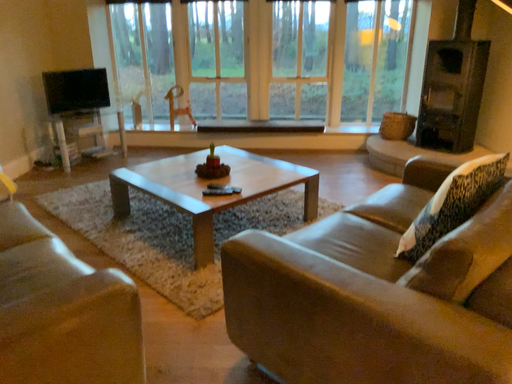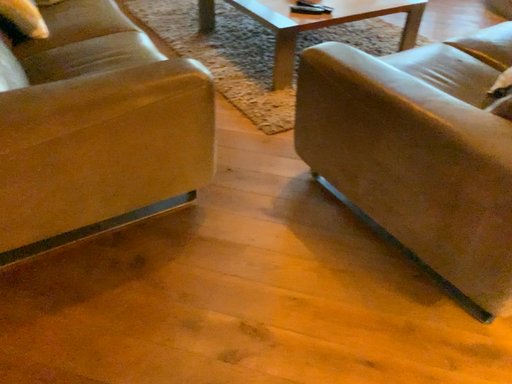
Question: Which way did the camera rotate in the video?

Choices:
 (A) rotated left
 (B) rotated right

Answer: (A)